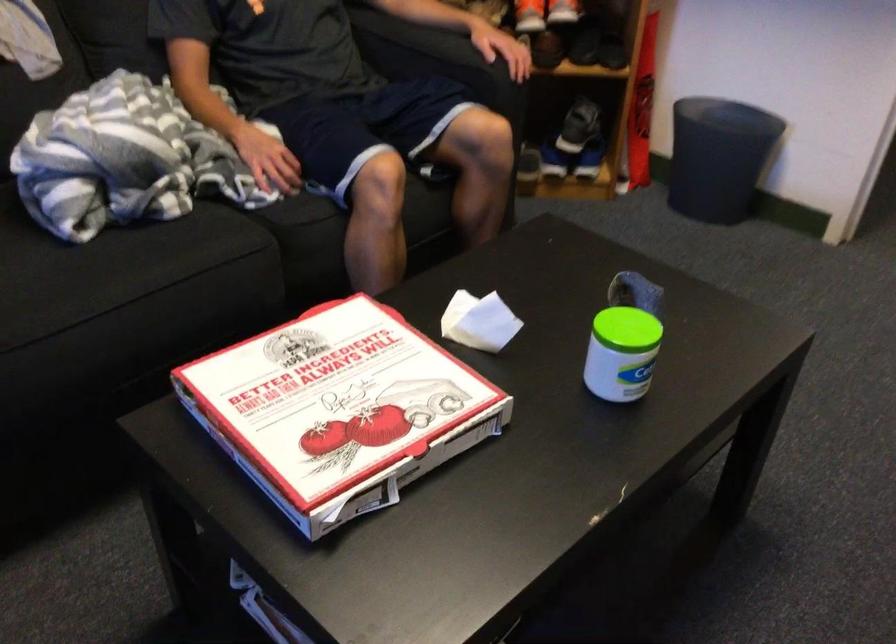
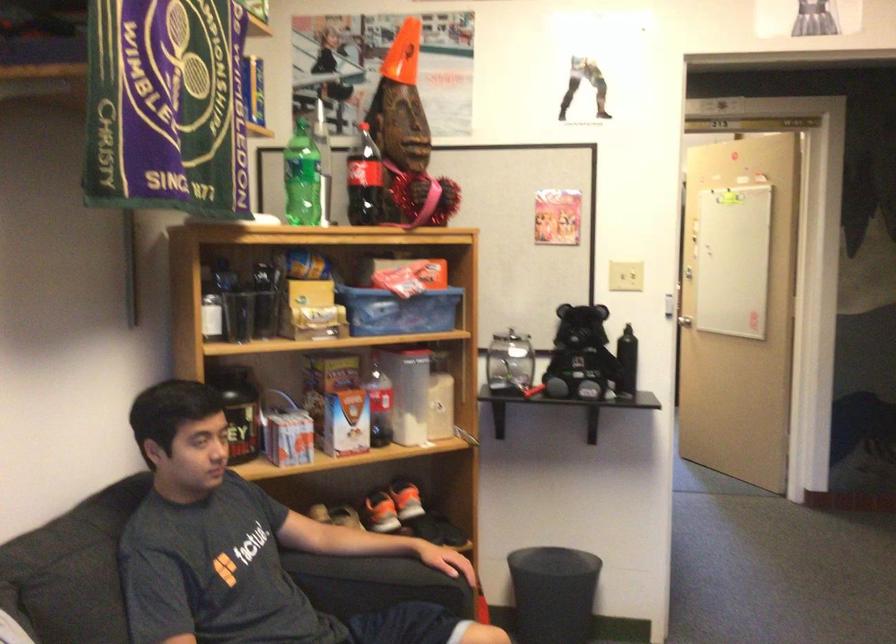
The images are taken continuously from a first-person perspective. In which direction is your viewpoint rotating?

The camera rotated toward right-up.